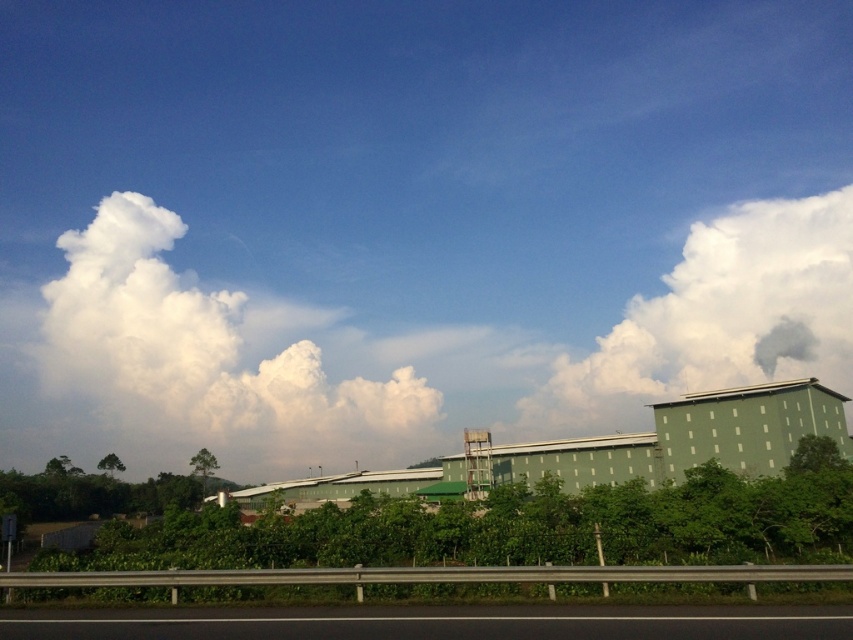
You are a drone operator who needs to fly a drone between the two clouds in the sky. Given that the white fluffy cloud at upper left and the white fluffy cloud at upper right are present, which cloud should you avoid flying under to ensure enough clearance?

You should avoid flying under the white fluffy cloud at upper left because it is much taller than the white fluffy cloud at upper right, providing less clearance space.

You are a drone operator trying to capture the white fluffy cloud at upper left. Your drone is currently at point (210, 355). Based on the scene, where should you direct your drone to fly to locate the white fluffy cloud at upper left?

The point (210, 355) marks the white fluffy cloud at upper left, so the drone is already at the correct location to capture it.

You are driving on a highway and see the image. You need to determine if the white fluffy cloud at upper right is blocking your view of the black asphalt highway at lower center. Is the cloud in front of the highway or behind it?

The black asphalt highway at lower center is behind the white fluffy cloud at upper right, so the cloud is in front of the highway and could be blocking your view.